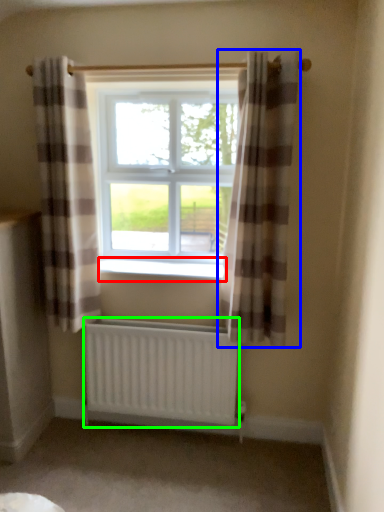
Question: Based on their relative distances, which object is farther from window sill (highlighted by a red box)? Choose from curtain (highlighted by a blue box) and radiator (highlighted by a green box).

Choices:
 (A) curtain
 (B) radiator

Answer: (B)